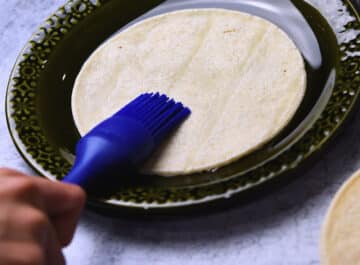
This screenshot has width=360, height=265. Find the location of `counter`. counter is located at coordinates (262, 249).